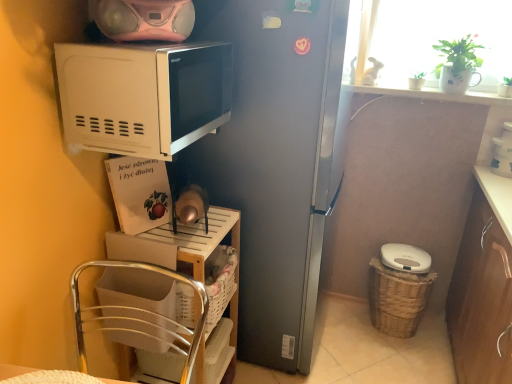
Question: Can you confirm if satin silver fridge at center is taller than metallic silver chair at lower left?

Choices:
 (A) yes
 (B) no

Answer: (A)

Question: From a real-world perspective, is satin silver fridge at center physically below metallic silver chair at lower left?

Choices:
 (A) no
 (B) yes

Answer: (A)

Question: Does satin silver fridge at center lie behind metallic silver chair at lower left?

Choices:
 (A) no
 (B) yes

Answer: (B)

Question: Is satin silver fridge at center bigger than metallic silver chair at lower left?

Choices:
 (A) yes
 (B) no

Answer: (A)

Question: From a real-world perspective, is satin silver fridge at center on metallic silver chair at lower left?

Choices:
 (A) no
 (B) yes

Answer: (B)

Question: Can you confirm if satin silver fridge at center is smaller than metallic silver chair at lower left?

Choices:
 (A) yes
 (B) no

Answer: (B)

Question: Does brown wood cabinet at lower right have a larger size compared to white glossy coffee maker at upper right, arranged as the 1th appliance when viewed from the right?

Choices:
 (A) no
 (B) yes

Answer: (B)

Question: Is brown wood cabinet at lower right further to the viewer compared to white glossy coffee maker at upper right, which is the second appliance in bottom-to-top order?

Choices:
 (A) yes
 (B) no

Answer: (B)

Question: Is brown wood cabinet at lower right at the left side of white glossy coffee maker at upper right, which is the second appliance in bottom-to-top order?

Choices:
 (A) no
 (B) yes

Answer: (B)

Question: Considering the relative sizes of brown wood cabinet at lower right and white glossy coffee maker at upper right, arranged as the 1th appliance when viewed from the right, in the image provided, is brown wood cabinet at lower right thinner than white glossy coffee maker at upper right, arranged as the 1th appliance when viewed from the right,?

Choices:
 (A) no
 (B) yes

Answer: (A)

Question: Can you confirm if brown wood cabinet at lower right is taller than white glossy coffee maker at upper right, which is counted as the second appliance, starting from the top?

Choices:
 (A) yes
 (B) no

Answer: (A)

Question: Is brown wood cabinet at lower right aimed at white glossy coffee maker at upper right, arranged as the 1th appliance when viewed from the right?

Choices:
 (A) yes
 (B) no

Answer: (B)

Question: From a real-world perspective, is white matte microwave at upper left below white plastic trash can at lower right, arranged as the third appliance when viewed from the front?

Choices:
 (A) no
 (B) yes

Answer: (A)